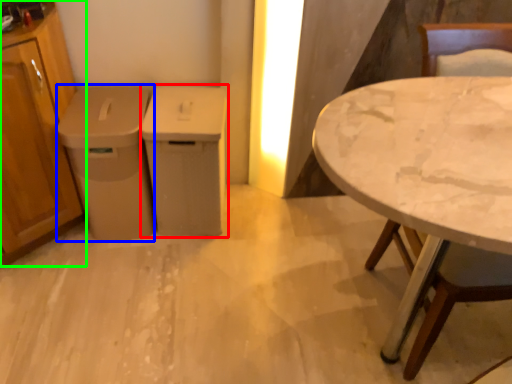
Question: Which object is positioned farthest from cabinetry (highlighted by a red box)? Select from cabinetry (highlighted by a blue box) and cabinetry (highlighted by a green box).

Choices:
 (A) cabinetry
 (B) cabinetry

Answer: (B)